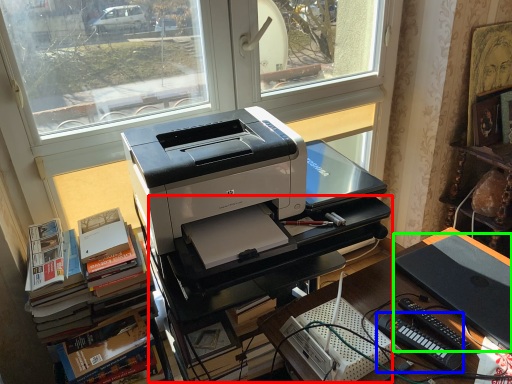
Question: Which is nearer to the computer desk (highlighted by a red box)? equipment (highlighted by a blue box) or computer (highlighted by a green box).

Choices:
 (A) equipment
 (B) computer

Answer: (B)